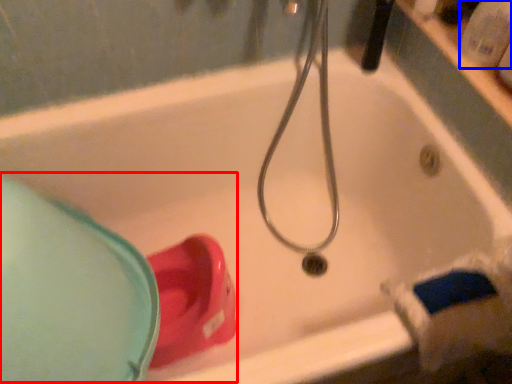
Question: Among these objects, which one is farthest to the camera, sink (highlighted by a red box) or toiletry (highlighted by a blue box)?

Choices:
 (A) sink
 (B) toiletry

Answer: (B)